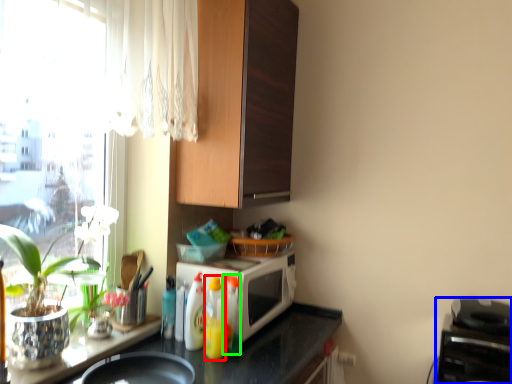
Question: Which object is positioned farthest from bottle (highlighted by a red box)? Select from appliance (highlighted by a blue box) and bottle (highlighted by a green box).

Choices:
 (A) appliance
 (B) bottle

Answer: (A)